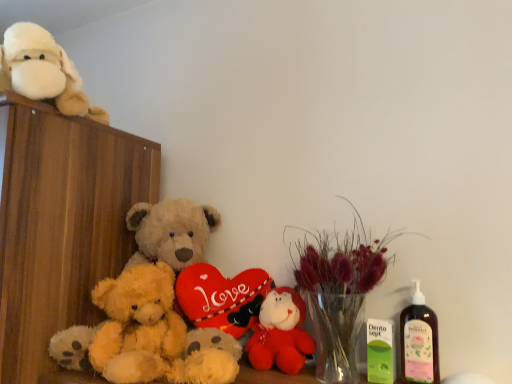
Question: Considering the relative sizes of wooden cabinet at left and fluffy yellow teddy bear at center, the 1th teddy bear positioned from the bottom, in the image provided, is wooden cabinet at left thinner than fluffy yellow teddy bear at center, the 1th teddy bear positioned from the bottom,?

Choices:
 (A) yes
 (B) no

Answer: (B)

Question: Is the position of wooden cabinet at left more distant than that of fluffy yellow teddy bear at center, the 1th teddy bear positioned from the bottom?

Choices:
 (A) no
 (B) yes

Answer: (A)

Question: Does wooden cabinet at left appear on the right side of fluffy yellow teddy bear at center, the 1th teddy bear positioned from the bottom?

Choices:
 (A) no
 (B) yes

Answer: (A)

Question: Can you confirm if wooden cabinet at left is bigger than fluffy yellow teddy bear at center, the 1th teddy bear positioned from the bottom?

Choices:
 (A) yes
 (B) no

Answer: (A)

Question: Does wooden cabinet at left appear on the left side of fluffy yellow teddy bear at center, which is the 3th teddy bear in top-to-bottom order?

Choices:
 (A) yes
 (B) no

Answer: (A)

Question: From a real-world perspective, is wooden cabinet at left above or below white plush toy at upper left, marked as the 3th teddy bear in a bottom-to-top arrangement?

Choices:
 (A) below
 (B) above

Answer: (A)

Question: Choose the correct answer: Is wooden cabinet at left inside white plush toy at upper left, marked as the 3th teddy bear in a bottom-to-top arrangement, or outside it?

Choices:
 (A) inside
 (B) outside

Answer: (B)

Question: From the image's perspective, is wooden cabinet at left positioned above or below white plush toy at upper left, marked as the 3th teddy bear in a bottom-to-top arrangement?

Choices:
 (A) above
 (B) below

Answer: (B)

Question: Visually, is wooden cabinet at left positioned to the left or to the right of white plush toy at upper left, marked as the 1th teddy bear in a top-to-bottom arrangement?

Choices:
 (A) left
 (B) right

Answer: (A)

Question: Choose the correct answer: Is pink plastic bottle at right inside wooden cabinet at left or outside it?

Choices:
 (A) inside
 (B) outside

Answer: (B)

Question: Relative to wooden cabinet at left, is pink plastic bottle at right in front or behind?

Choices:
 (A) behind
 (B) front

Answer: (A)

Question: Is pink plastic bottle at right wider or thinner than wooden cabinet at left?

Choices:
 (A) thin
 (B) wide

Answer: (A)

Question: From a real-world perspective, is pink plastic bottle at right physically located above or below wooden cabinet at left?

Choices:
 (A) below
 (B) above

Answer: (A)

Question: Does point (290, 302) appear closer or farther from the camera than point (19, 56)?

Choices:
 (A) closer
 (B) farther

Answer: (B)

Question: In the image, is velvet red plush toy at center on the left side or the right side of white plush toy at upper left, marked as the 3th teddy bear in a bottom-to-top arrangement?

Choices:
 (A) left
 (B) right

Answer: (B)